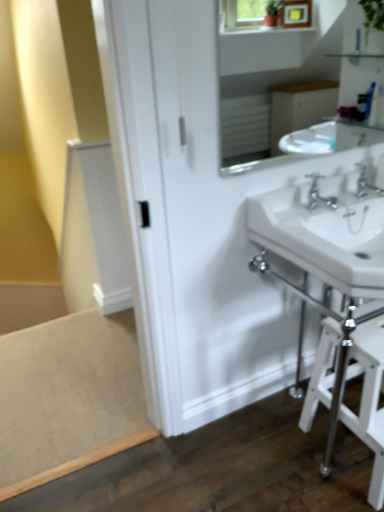
Question: From a real-world perspective, is chrome metallic faucet at upper right, which ranks as the second tap in left-to-right order, positioned over white glossy sink at upper center based on gravity?

Choices:
 (A) no
 (B) yes

Answer: (A)

Question: Is chrome metallic faucet at upper right, positioned as the first tap in right-to-left order, outside white glossy sink at upper center?

Choices:
 (A) no
 (B) yes

Answer: (B)

Question: Is chrome metallic faucet at upper right, positioned as the first tap in right-to-left order, facing away from white glossy sink at upper center?

Choices:
 (A) no
 (B) yes

Answer: (A)

Question: From the image's perspective, would you say chrome metallic faucet at upper right, which ranks as the second tap in left-to-right order, is positioned over white glossy sink at upper center?

Choices:
 (A) yes
 (B) no

Answer: (B)

Question: Considering the relative sizes of chrome metallic faucet at upper right, positioned as the first tap in right-to-left order, and white glossy sink at upper center in the image provided, is chrome metallic faucet at upper right, positioned as the first tap in right-to-left order, thinner than white glossy sink at upper center?

Choices:
 (A) yes
 (B) no

Answer: (B)

Question: Is chrome metallic faucet at center, positioned as the 2th tap in right-to-left order, inside or outside of chrome metallic faucet at upper right, which ranks as the second tap in left-to-right order?

Choices:
 (A) inside
 (B) outside

Answer: (B)

Question: Considering the positions of point coord(314,181) and point coord(359,180), is point coord(314,181) closer or farther from the camera than point coord(359,180)?

Choices:
 (A) farther
 (B) closer

Answer: (B)

Question: Is chrome metallic faucet at center, positioned as the 2th tap in right-to-left order, wider or thinner than chrome metallic faucet at upper right, which ranks as the second tap in left-to-right order?

Choices:
 (A) wide
 (B) thin

Answer: (A)

Question: Based on their sizes in the image, would you say chrome metallic faucet at center, positioned as the 1th tap in left-to-right order, is bigger or smaller than chrome metallic faucet at upper right, positioned as the first tap in right-to-left order?

Choices:
 (A) big
 (B) small

Answer: (A)

Question: From the image's perspective, is chrome metallic faucet at upper right, positioned as the first tap in right-to-left order, above or below white glossy sink at upper center?

Choices:
 (A) below
 (B) above

Answer: (A)

Question: From their relative heights in the image, would you say chrome metallic faucet at upper right, positioned as the first tap in right-to-left order, is taller or shorter than white glossy sink at upper center?

Choices:
 (A) short
 (B) tall

Answer: (A)

Question: Does point (x=359, y=183) appear closer or farther from the camera than point (x=344, y=74)?

Choices:
 (A) closer
 (B) farther

Answer: (A)

Question: From a real-world perspective, is chrome metallic faucet at upper right, positioned as the first tap in right-to-left order, positioned above or below white glossy sink at upper center?

Choices:
 (A) below
 (B) above

Answer: (A)

Question: From their relative heights in the image, would you say chrome metallic faucet at center, positioned as the 1th tap in left-to-right order, is taller or shorter than white glossy table at lower right?

Choices:
 (A) short
 (B) tall

Answer: (A)

Question: Which is correct: chrome metallic faucet at center, positioned as the 2th tap in right-to-left order, is inside white glossy table at lower right, or outside of it?

Choices:
 (A) outside
 (B) inside

Answer: (A)